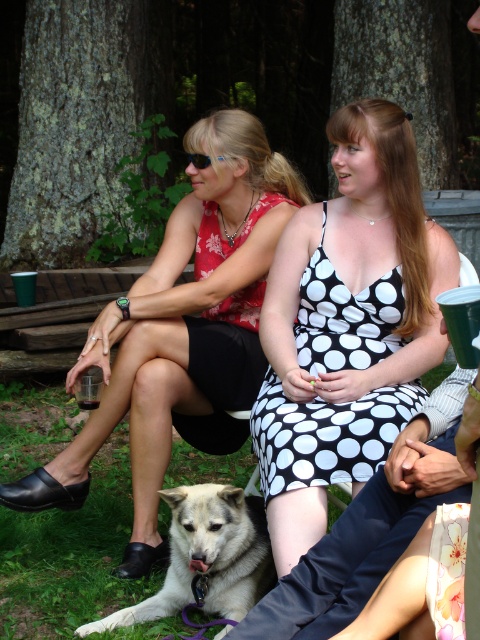
Can you confirm if matte black dress at center is positioned to the right of white fur dog at lower left?

In fact, matte black dress at center is to the left of white fur dog at lower left.

Which is in front, point (228, 264) or point (227, 627)?

Point (227, 627) is in front.

This screenshot has width=480, height=640. What are the coordinates of `matte black dress at center` in the screenshot? It's located at click(x=181, y=330).

Does black dotted dress at center lie behind white fur dog at lower left?

Yes, it is.

Which is below, black dotted dress at center or white fur dog at lower left?

Positioned lower is white fur dog at lower left.

Is point (355, 362) more distant than point (269, 577)?

Yes, it is behind point (269, 577).

Image resolution: width=480 pixels, height=640 pixels. I want to click on black dotted dress at center, so click(325, 435).

Can you confirm if matte black dress at center is positioned above black dotted dress at center?

Yes, matte black dress at center is above black dotted dress at center.

Is point (143, 484) positioned in front of point (385, 280)?

No, it is behind (385, 280).

Between point (244, 301) and point (422, 400), which one is positioned behind?

Point (244, 301)

Image resolution: width=480 pixels, height=640 pixels. What are the coordinates of `matte black dress at center` in the screenshot? It's located at (181, 330).